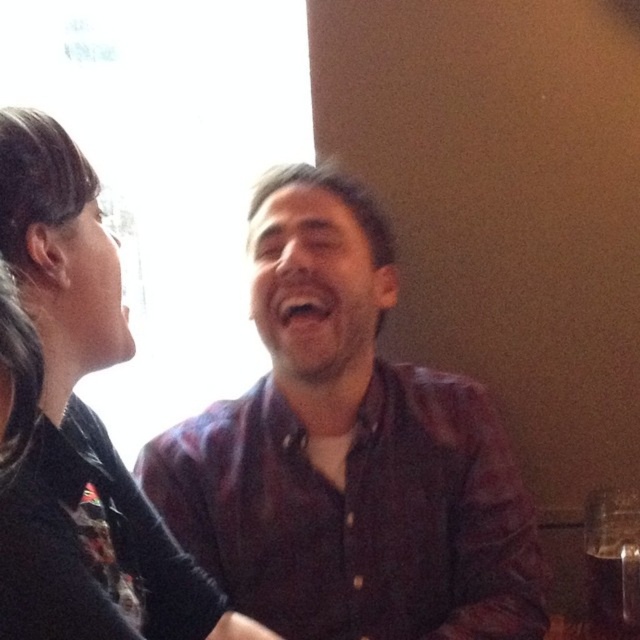
Based on the coordinates provided, which object is located at point (346, 452) in the image?

The point (346, 452) indicates the dark brown shirt at center.

You are a photographer trying to capture a candid shot of the dark brown shirt at center and the black leather jacket at upper left. Which object should you focus on first if you want to capture both in one frame without moving the camera?

The dark brown shirt at center is positioned on the right side of black leather jacket at upper left, so you should focus on the black leather jacket at upper left first to ensure both are in the frame.